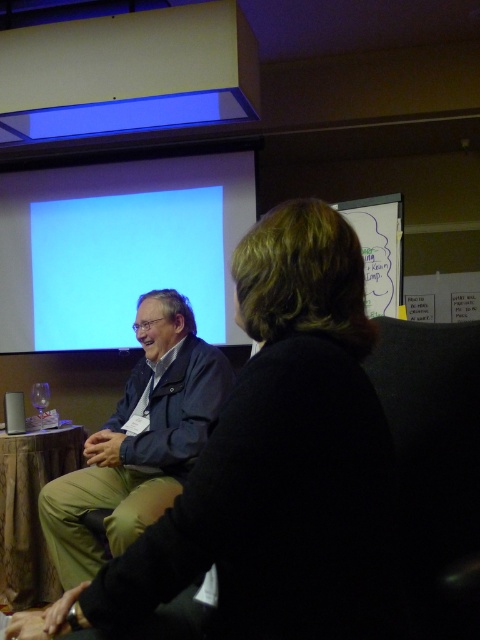
In the scene shown: Is black fabric jacket at center shorter than light blue matte projection screen at upper center?

Yes, black fabric jacket at center is shorter than light blue matte projection screen at upper center.

Who is more distant from viewer, (350, 458) or (4, 284)?

Positioned behind is point (4, 284).

Where is `black fabric jacket at center`? This screenshot has height=640, width=480. black fabric jacket at center is located at coordinates (275, 468).

The width and height of the screenshot is (480, 640). What are the coordinates of `black fabric jacket at center` in the screenshot? It's located at (275, 468).

Does black fabric jacket at center lie in front of dark blue jacket at center?

Yes, black fabric jacket at center is in front of dark blue jacket at center.

Who is more distant from viewer, (274, 362) or (46, 536)?

Point (46, 536)

At what (x,y) coordinates should I click in order to perform the action: click on black fabric jacket at center. Please return your answer as a coordinate pair (x, y). Image resolution: width=480 pixels, height=640 pixels. Looking at the image, I should click on (275, 468).

Locate an element on the screen. light blue matte projection screen at upper center is located at coordinates (119, 248).

Is light blue matte projection screen at upper center positioned at the back of dark blue jacket at center?

Yes, it is behind dark blue jacket at center.

Is point (81, 225) farther from viewer compared to point (64, 564)?

That is True.

Where is `light blue matte projection screen at upper center`? The height and width of the screenshot is (640, 480). light blue matte projection screen at upper center is located at coordinates (119, 248).